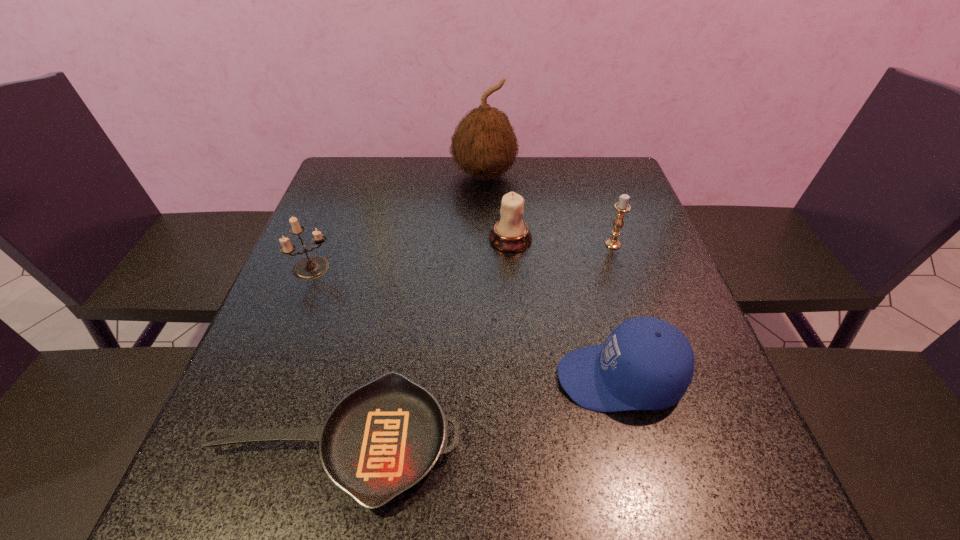
Identify the location of candle holder at the right edge. Image resolution: width=960 pixels, height=540 pixels. (622, 207).

Identify the location of cap situated at the right edge. The height and width of the screenshot is (540, 960). (646, 363).

The width and height of the screenshot is (960, 540). I want to click on object that is at the near left corner, so click(x=384, y=437).

Image resolution: width=960 pixels, height=540 pixels. I want to click on free space at the far edge of the desktop, so click(x=555, y=192).

This screenshot has width=960, height=540. In order to click on vacant area at the left edge of the desktop in this screenshot , I will do `click(273, 306)`.

At what (x,y) coordinates should I click in order to perform the action: click on vacant space at the right edge of the desktop. Please return your answer as a coordinate pair (x, y). This screenshot has height=540, width=960. Looking at the image, I should click on (642, 224).

In the image, there is a desktop. What are the coordinates of `vacant space at the far left corner` in the screenshot? It's located at (336, 197).

Find the location of a particular element. vacant area that lies between the frying pan and the cap is located at coordinates (478, 410).

Where is `vacant point located between the coconut and the cap`? vacant point located between the coconut and the cap is located at coordinates (552, 276).

In order to click on free space between the shortest object and the cap in this screenshot , I will do `click(478, 410)`.